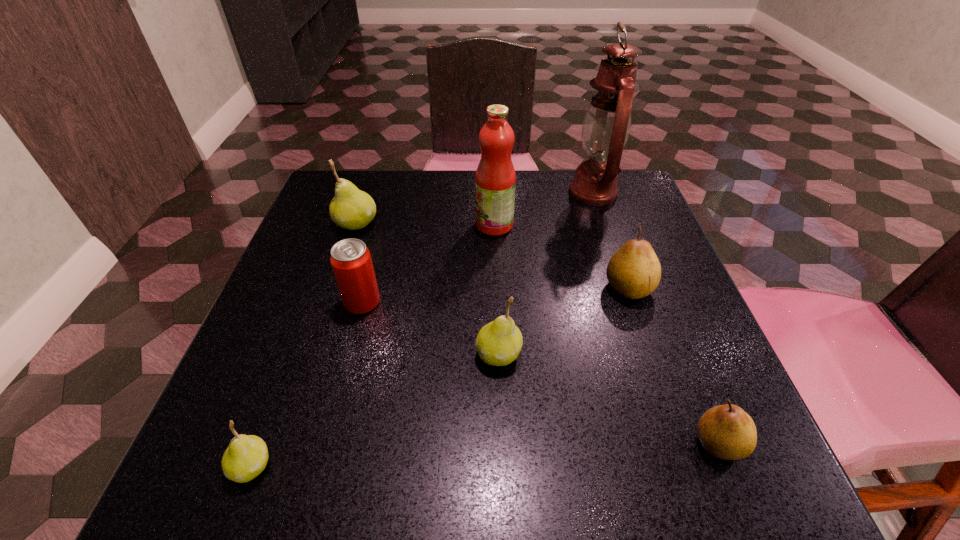
Where is `the tallest object`? The height and width of the screenshot is (540, 960). the tallest object is located at coordinates click(x=606, y=127).

This screenshot has height=540, width=960. Identify the location of oil lamp. (606, 127).

The image size is (960, 540). I want to click on fruit juice, so click(x=495, y=180).

Where is `pink fruit juice`? The height and width of the screenshot is (540, 960). pink fruit juice is located at coordinates (495, 180).

The image size is (960, 540). Identify the location of the tallest pear. (352, 209).

Locate an element on the screen. This screenshot has width=960, height=540. the farthest pear is located at coordinates [352, 209].

Find the location of a particular element. The width and height of the screenshot is (960, 540). red can is located at coordinates (351, 261).

The height and width of the screenshot is (540, 960). In order to click on the bigger brown pear in this screenshot , I will do `click(634, 271)`.

What are the coordinates of `the farther brown pear` in the screenshot? It's located at (634, 271).

This screenshot has width=960, height=540. I want to click on the sixth farthest object, so (498, 343).